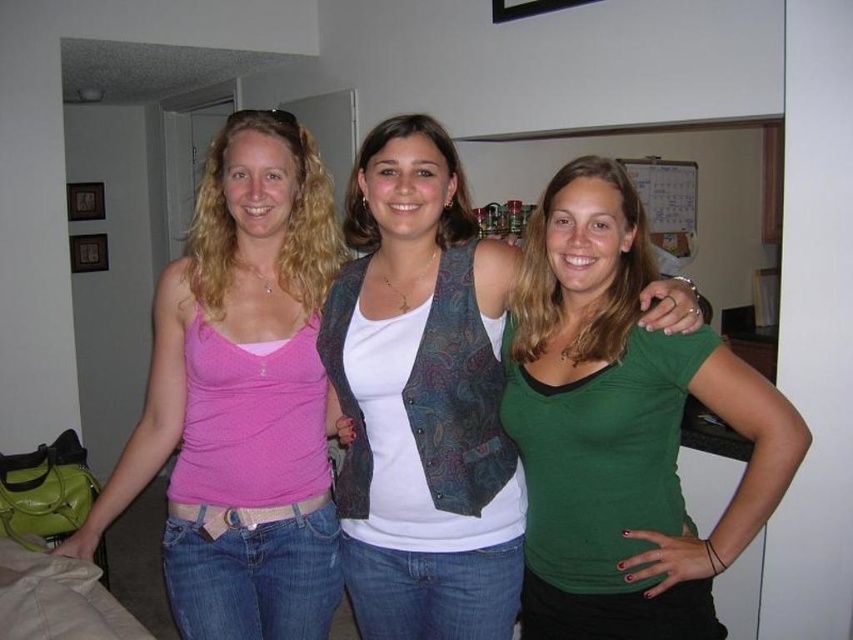
Does pink matte tank top at left appear over green matte shirt at center?

Correct, pink matte tank top at left is located above green matte shirt at center.

Can you confirm if pink matte tank top at left is positioned to the left of green matte shirt at center?

Yes, pink matte tank top at left is to the left of green matte shirt at center.

Does point (277, 330) come behind point (532, 381)?

Yes, point (277, 330) is behind point (532, 381).

At what (x,y) coordinates should I click in order to perform the action: click on pink matte tank top at left. Please return your answer as a coordinate pair (x, y). Looking at the image, I should click on (242, 397).